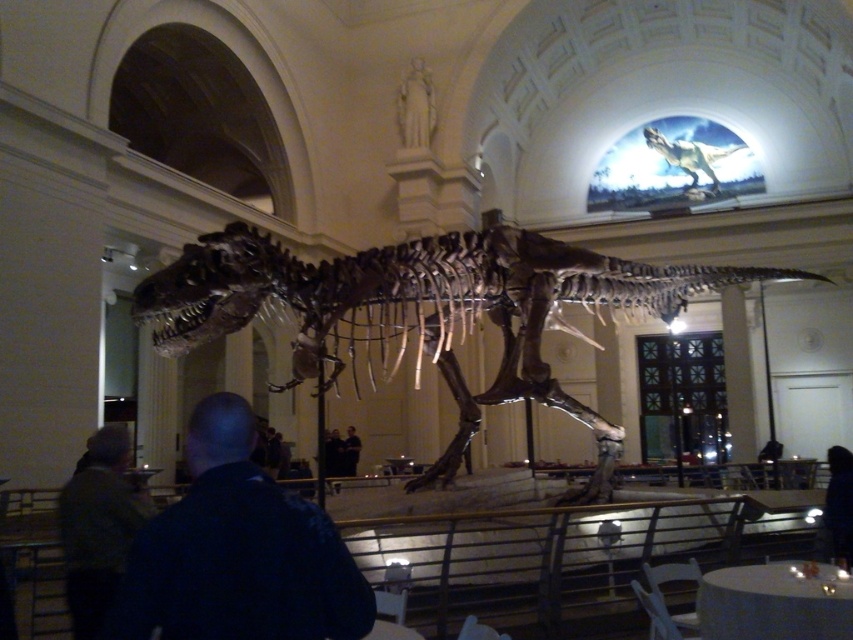
Based on the photo, between dark brown leather jacket at lower left and dark blue shirt at center, which one appears on the left side from the viewer's perspective?

dark brown leather jacket at lower left

Measure the distance between dark brown leather jacket at lower left and camera.

dark brown leather jacket at lower left and camera are 11.81 meters apart from each other.

In order to click on dark brown leather jacket at lower left in this screenshot , I will do click(97, 528).

Consider the image. Does shiny metallic skeleton at center have a greater width compared to dark blue shirt at center?

Yes.

Who is more forward, (270, 307) or (360, 442)?

Positioned in front is point (270, 307).

The image size is (853, 640). In order to click on shiny metallic skeleton at center in this screenshot , I will do `click(422, 312)`.

What do you see at coordinates (238, 552) in the screenshot? I see `dark blue shirt at lower left` at bounding box center [238, 552].

Is dark blue shirt at lower left taller than dark brown leather jacket at lower left?

No, dark blue shirt at lower left is not taller than dark brown leather jacket at lower left.

Between point (305, 502) and point (97, 528), which one is positioned in front?

Positioned in front is point (305, 502).

Locate an element on the screen. The width and height of the screenshot is (853, 640). dark blue shirt at lower left is located at coordinates (238, 552).